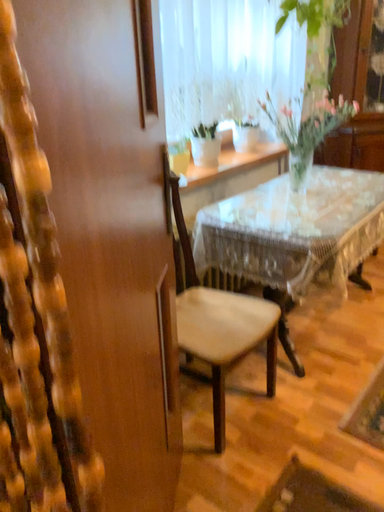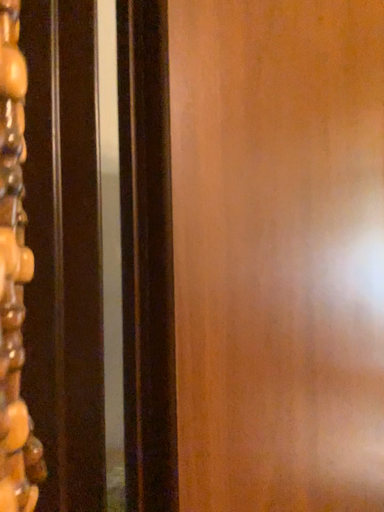
Question: Which way did the camera rotate in the video?

Choices:
 (A) rotated left
 (B) rotated right

Answer: (A)